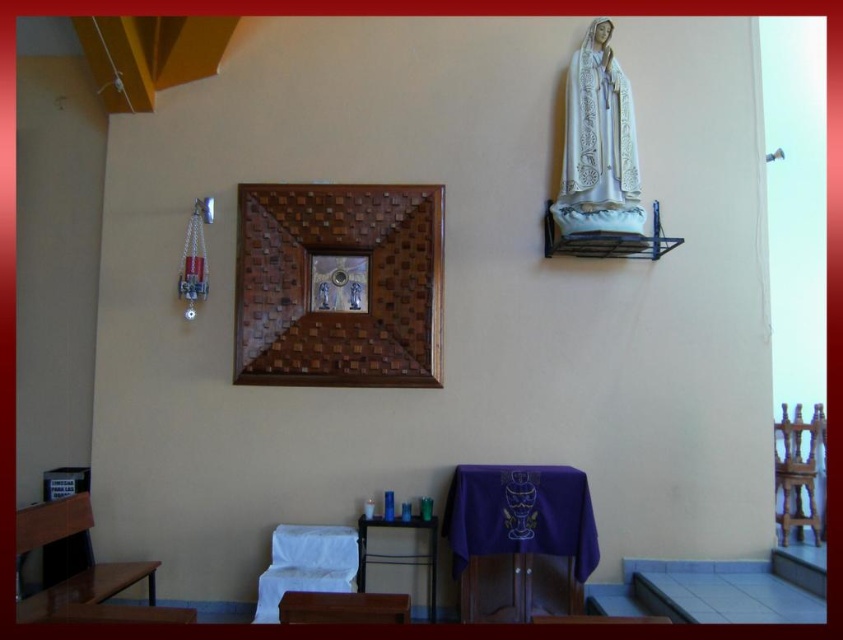
Does white lace robe at upper right appear on the left side of wooden chair at right?

Indeed, white lace robe at upper right is positioned on the left side of wooden chair at right.

Does white lace robe at upper right have a greater width compared to wooden chair at right?

Correct, the width of white lace robe at upper right exceeds that of wooden chair at right.

Between point (616, 81) and point (808, 470), which one is positioned in front?

Point (616, 81) is more forward.

At what (x,y) coordinates should I click in order to perform the action: click on white lace robe at upper right. Please return your answer as a coordinate pair (x, y). Looking at the image, I should click on (599, 129).

Find the location of a particular element. white fabric chair at lower center is located at coordinates (305, 564).

Who is positioned more to the left, white fabric chair at lower center or wooden chair at right?

Positioned to the left is white fabric chair at lower center.

Identify the location of white fabric chair at lower center. (305, 564).

Which is behind, point (320, 344) or point (280, 579)?

The point (320, 344) is behind.

This screenshot has height=640, width=843. What are the coordinates of `woven wood picture frame at upper center` in the screenshot? It's located at (337, 312).